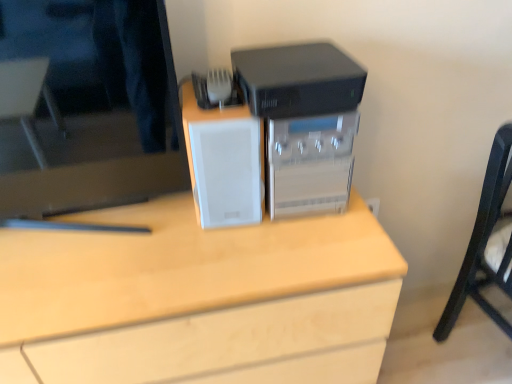
Measure the distance between white matte desk at center and camera.

31.87 inches.

In order to face matte black monitor at upper left, should I rotate leftwards or rightwards?

A 23.856 degree turn to the left will do.

What is the approximate width of sleek plastic printer at center?

It is 12.78 inches.

This screenshot has width=512, height=384. I want to click on white matte desk at center, so click(198, 299).

Looking at this image, can you confirm if white matte desk at center is taller than sleek plastic printer at center?

Indeed, white matte desk at center has a greater height compared to sleek plastic printer at center.

From the image's perspective, would you say white matte desk at center is positioned over sleek plastic printer at center?

Actually, white matte desk at center appears below sleek plastic printer at center in the image.

I want to click on desk that appears below the sleek plastic printer at center (from a real-world perspective), so click(198, 299).

How distant is white matte desk at center from sleek plastic printer at center?

A distance of 11.54 inches exists between white matte desk at center and sleek plastic printer at center.

Between white matte desk at center and white matte speaker at center, which one has smaller width?

With smaller width is white matte speaker at center.

Is white matte desk at center positioned with its back to white matte speaker at center?

No, white matte speaker at center is not at the back of white matte desk at center.

Looking at this image, considering the relative sizes of white matte desk at center and white matte speaker at center in the image provided, is white matte desk at center bigger than white matte speaker at center?

Correct, white matte desk at center is larger in size than white matte speaker at center.

From a real-world perspective, between sleek plastic printer at center and matte black monitor at upper left, who is vertically lower?

sleek plastic printer at center, from a real-world perspective.

In the scene shown: Is sleek plastic printer at center next to matte black monitor at upper left and touching it?

No, sleek plastic printer at center is not touching matte black monitor at upper left.

Considering the positions of points (327, 125) and (153, 170), is point (327, 125) closer to camera compared to point (153, 170)?

Yes, point (327, 125) is in front of point (153, 170).

In the image, is sleek plastic printer at center positioned in front of or behind matte black monitor at upper left?

sleek plastic printer at center is behind matte black monitor at upper left.

From the image's perspective, is sleek plastic printer at center above or below white matte speaker at center?

Based on their image positions, sleek plastic printer at center is located above white matte speaker at center.

Is sleek plastic printer at center shorter than white matte speaker at center?

Correct, sleek plastic printer at center is not as tall as white matte speaker at center.

From a real-world perspective, relative to white matte speaker at center, is sleek plastic printer at center vertically above or below?

sleek plastic printer at center is below white matte speaker at center.

From the image's perspective, would you say matte black monitor at upper left is positioned over sleek plastic printer at center?

Yes, from the image's perspective, matte black monitor at upper left is on top of sleek plastic printer at center.

Is matte black monitor at upper left positioned in front of sleek plastic printer at center?

Yes, the depth of matte black monitor at upper left is less than that of sleek plastic printer at center.

Could sleek plastic printer at center be considered to be inside matte black monitor at upper left?

No, sleek plastic printer at center is not inside matte black monitor at upper left.

Based on their sizes in the image, would you say matte black monitor at upper left is bigger or smaller than sleek plastic printer at center?

In the image, matte black monitor at upper left appears to be larger than sleek plastic printer at center.

Which is in front, white matte speaker at center or matte black monitor at upper left?

matte black monitor at upper left is more forward.

How different are the orientations of white matte speaker at center and matte black monitor at upper left in degrees?

The angle between the facing direction of white matte speaker at center and the facing direction of matte black monitor at upper left is 4.72 degrees.

Is white matte speaker at center positioned beyond the bounds of matte black monitor at upper left?

Indeed, white matte speaker at center is completely outside matte black monitor at upper left.

From the picture: Could you tell me if white matte speaker at center is turned towards matte black monitor at upper left?

No, white matte speaker at center is not facing towards matte black monitor at upper left.

Does point (258, 158) come behind point (91, 307)?

Yes, point (258, 158) is behind point (91, 307).

Can you confirm if white matte speaker at center is thinner than white matte desk at center?

Yes, white matte speaker at center is thinner than white matte desk at center.

Is white matte speaker at center bigger than white matte desk at center?

Incorrect, white matte speaker at center is not larger than white matte desk at center.

From the image's perspective, between white matte speaker at center and white matte desk at center, which one is located above?

white matte speaker at center.

Image resolution: width=512 pixels, height=384 pixels. I want to click on home appliance above the white matte desk at center (from a real-world perspective), so click(x=304, y=122).

Locate an element on the screen. The height and width of the screenshot is (384, 512). desk below the white matte speaker at center (from the image's perspective) is located at coordinates (198, 299).

Estimate the real-world distances between objects in this image. Which object is closer to white matte desk at center, matte black monitor at upper left or sleek plastic printer at center?

Based on the image, matte black monitor at upper left appears to be nearer to white matte desk at center.

Based on their spatial positions, is white matte speaker at center or white matte desk at center further from sleek plastic printer at center?

white matte desk at center is positioned further to the anchor sleek plastic printer at center.

When comparing their distances from matte black monitor at upper left, does white matte speaker at center or white matte desk at center seem closer?

Based on the image, white matte speaker at center appears to be nearer to matte black monitor at upper left.

From the image, which object appears to be nearer to matte black monitor at upper left, white matte speaker at center or sleek plastic printer at center?

Among the two, white matte speaker at center is located nearer to matte black monitor at upper left.

Based on their spatial positions, is sleek plastic printer at center or white matte speaker at center closer to white matte desk at center?

white matte speaker at center is positioned closer to the anchor white matte desk at center.

From the image, which object appears to be nearer to sleek plastic printer at center, white matte speaker at center or matte black monitor at upper left?

white matte speaker at center is positioned closer to the anchor sleek plastic printer at center.

Which object lies further to the anchor point white matte speaker at center, white matte desk at center or matte black monitor at upper left?

Based on the image, white matte desk at center appears to be further to white matte speaker at center.

Considering their positions, is white matte speaker at center positioned further to white matte desk at center than sleek plastic printer at center?

sleek plastic printer at center lies further to white matte desk at center than the other object.

You are a GUI agent. You are given a task and a screenshot of the screen. Output one action in this format:
    pyautogui.click(x=<x>, y=<y>)
    Task: Click on the speaker between sleek plastic printer at center and white matte desk at center vertically
    
    Given the screenshot: What is the action you would take?
    pyautogui.click(x=227, y=172)

The height and width of the screenshot is (384, 512). Identify the location of speaker between matte black monitor at upper left and sleek plastic printer at center. (227, 172).

You are a GUI agent. You are given a task and a screenshot of the screen. Output one action in this format:
    pyautogui.click(x=<x>, y=<y>)
    Task: Click on the home appliance between matte black monitor at upper left and white matte desk at center vertically
    
    Given the screenshot: What is the action you would take?
    pyautogui.click(x=304, y=122)

At what (x,y) coordinates should I click in order to perform the action: click on speaker that lies between matte black monitor at upper left and white matte desk at center from top to bottom. Please return your answer as a coordinate pair (x, y). This screenshot has height=384, width=512. Looking at the image, I should click on (227, 172).